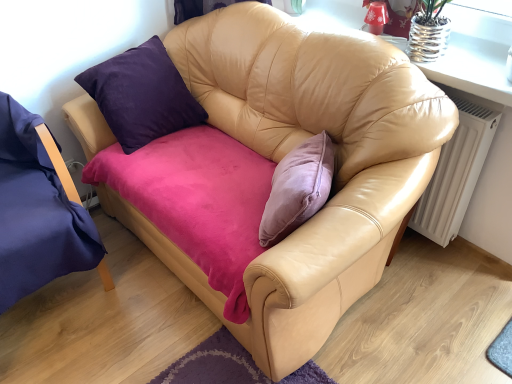
Question: Should I look upward or downward to see purple fabric chair at left?

Choices:
 (A) down
 (B) up

Answer: (A)

Question: Considering the relative sizes of purple fabric chair at left and white matte radiator at right in the image provided, is purple fabric chair at left wider than white matte radiator at right?

Choices:
 (A) no
 (B) yes

Answer: (B)

Question: Is purple fabric chair at left thinner than white matte radiator at right?

Choices:
 (A) yes
 (B) no

Answer: (B)

Question: Is purple fabric chair at left taller than white matte radiator at right?

Choices:
 (A) yes
 (B) no

Answer: (A)

Question: Is purple fabric chair at left shorter than white matte radiator at right?

Choices:
 (A) yes
 (B) no

Answer: (B)

Question: Is the position of purple fabric chair at left less distant than that of white matte radiator at right?

Choices:
 (A) yes
 (B) no

Answer: (A)

Question: Is purple fabric chair at left oriented towards white matte radiator at right?

Choices:
 (A) no
 (B) yes

Answer: (A)

Question: Does white matte radiator at right appear on the right side of purple fabric chair at left?

Choices:
 (A) yes
 (B) no

Answer: (A)

Question: Is purple fabric chair at left a part of white matte radiator at right?

Choices:
 (A) no
 (B) yes

Answer: (A)

Question: Can you confirm if white matte radiator at right is wider than purple fabric chair at left?

Choices:
 (A) yes
 (B) no

Answer: (B)

Question: Does white matte radiator at right have a greater height compared to purple fabric chair at left?

Choices:
 (A) yes
 (B) no

Answer: (B)

Question: From the image's perspective, does white matte radiator at right appear lower than purple fabric chair at left?

Choices:
 (A) no
 (B) yes

Answer: (A)

Question: Can you confirm if white matte radiator at right is smaller than purple fabric chair at left?

Choices:
 (A) no
 (B) yes

Answer: (B)

Question: Is white matte radiator at right bigger or smaller than purple fabric chair at left?

Choices:
 (A) big
 (B) small

Answer: (B)